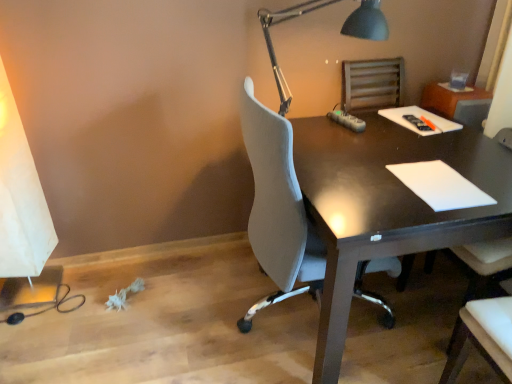
The image size is (512, 384). I want to click on free space behind white matte notepad at right, so click(416, 147).